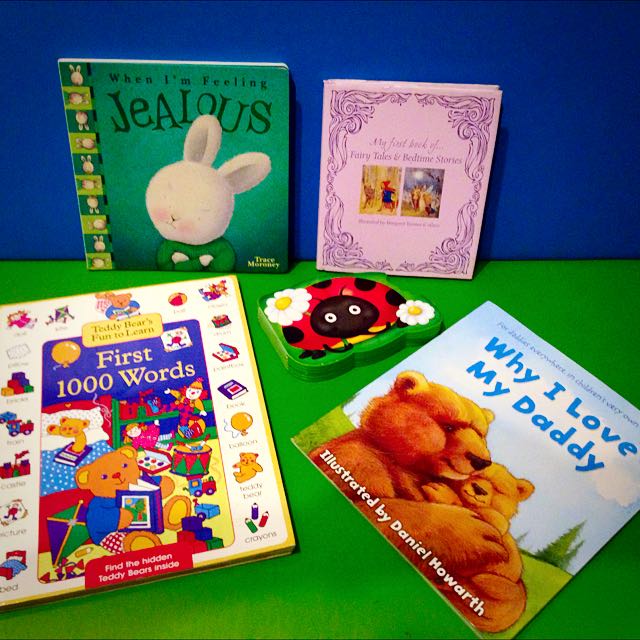
You are a GUI agent. You are given a task and a screenshot of the screen. Output one action in this format:
    pyautogui.click(x=<x>, y=<y>)
    Task: Click on the blue wall
    Image resolution: width=640 pixels, height=640 pixels.
    Given the screenshot: What is the action you would take?
    pyautogui.click(x=536, y=59)